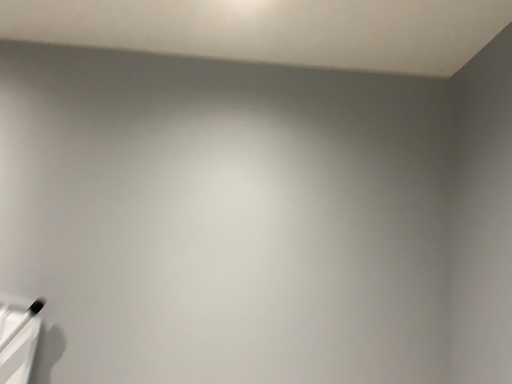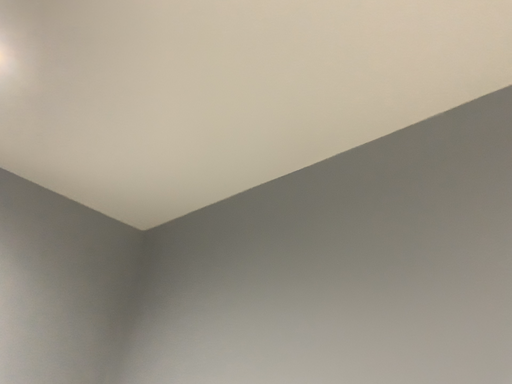
Question: How did the camera likely rotate when shooting the video?

Choices:
 (A) rotated downward
 (B) rotated upward

Answer: (B)